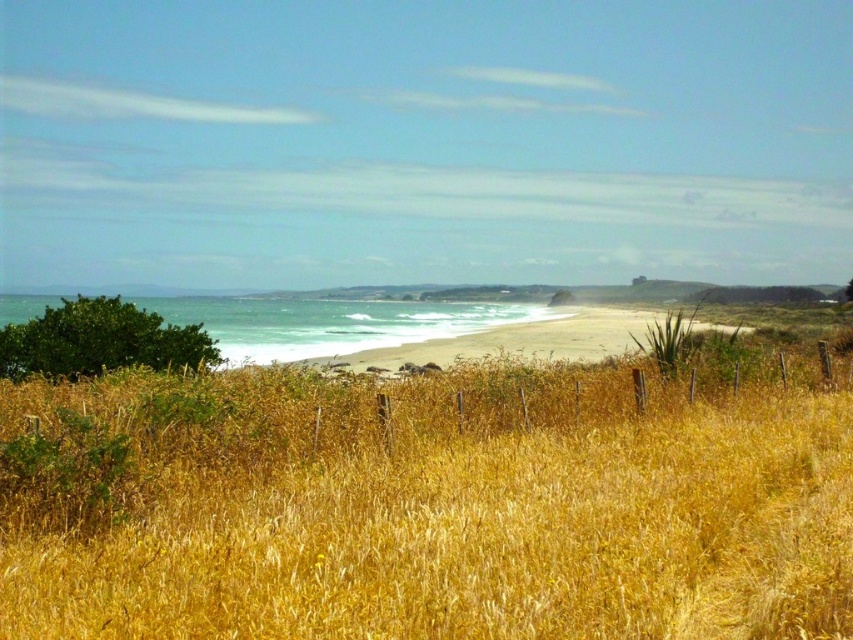
You are standing at the point marked by the coordinates point (450, 508) in the coastal landscape. What type of terrain are you currently standing on?

You are standing on dry golden grass at center, as indicated by the coordinates point (450, 508).

You are a photographer planning to capture the coastal landscape. You want to ensure the dry golden grass at center and the white sandy beach at center are both visible in your shot. Based on their positions, which one will appear closer to the camera lens?

The dry golden grass at center appears closer to the camera lens because it is positioned under the white sandy beach at center, indicating it is in the foreground.

You are a hiker planning to cross from the dry golden grass at center to the white sandy beach at center. Based on the scene description, which area is lower in elevation?

The dry golden grass at center is shorter than the white sandy beach at center, so the dry golden grass at center is lower in elevation.